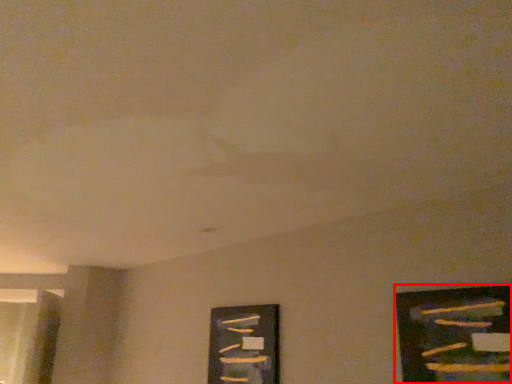
Question: From the image's perspective, what is the correct spatial positioning of picture frame (annotated by the red box) in reference to picture frame?

Choices:
 (A) below
 (B) above

Answer: (B)